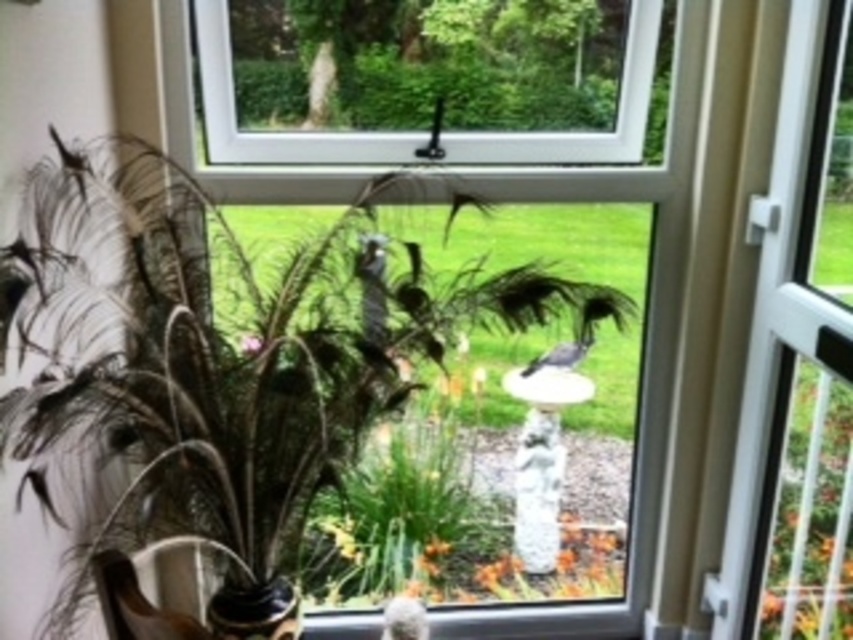
Question: Which object is the closest to the white plastic screen door at right?

Choices:
 (A) white fluffy bird at lower center
 (B) gray matte bird at center
 (C) green leafy plant at lower right

Answer: (C)

Question: Among these objects, which one is farthest from the camera?

Choices:
 (A) green leafy plant at lower right
 (B) white plastic screen door at right
 (C) smooth gray bird at center

Answer: (A)

Question: Does feathered vase at left have a larger size compared to smooth gray bird at center?

Choices:
 (A) no
 (B) yes

Answer: (B)

Question: Where is feathered vase at left located in relation to gray matte bird at center in the image?

Choices:
 (A) below
 (B) above

Answer: (A)

Question: Which object appears closest to the camera in this image?

Choices:
 (A) white fluffy bird at lower center
 (B) feathered vase at left
 (C) gray matte bird at center

Answer: (B)

Question: Does white plastic screen door at right lie in front of white fluffy bird at lower center?

Choices:
 (A) yes
 (B) no

Answer: (A)